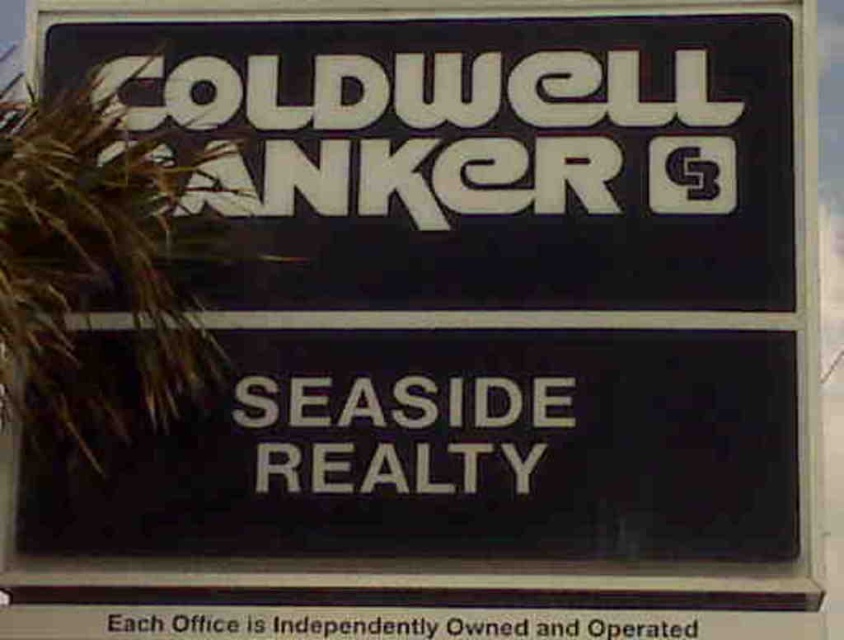
Question: Which is farther from the white matte sign at center?

Choices:
 (A) brown grass at left
 (B) black plastic text at lower center

Answer: (A)

Question: Which point appears farthest from the camera in this image?

Choices:
 (A) (460, 454)
 (B) (720, 541)

Answer: (A)

Question: Is white matte sign at center behind black plastic text at lower center?

Choices:
 (A) yes
 (B) no

Answer: (A)

Question: Observing the image, what is the correct spatial positioning of black matte sign at upper center in reference to white matte sign at center?

Choices:
 (A) below
 (B) above

Answer: (B)

Question: Which point appears closest to the camera in this image?

Choices:
 (A) (199, 342)
 (B) (634, 611)
 (C) (729, 52)

Answer: (B)

Question: Where is white matte sign at center located in relation to black plastic text at lower center in the image?

Choices:
 (A) below
 (B) above

Answer: (B)